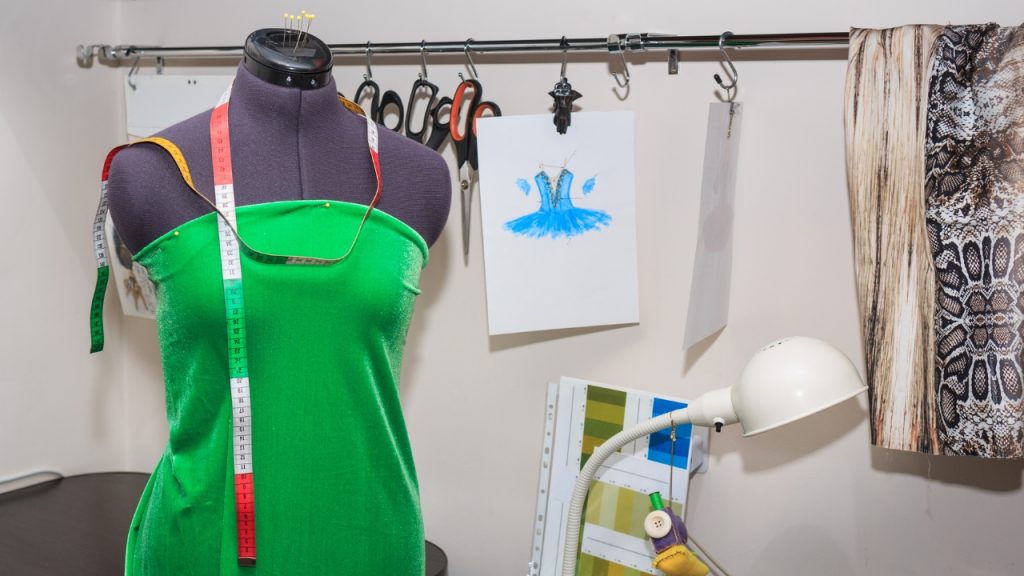
Point out all instances of where you turn the lamp on or off in the image. Your answer should be formatted as a list of tuples, i.e. [(x1, y1), (x2, y2), ...], where each tuple contains the x and y coordinates of a point satisfying the conditions above.

[(718, 420)]